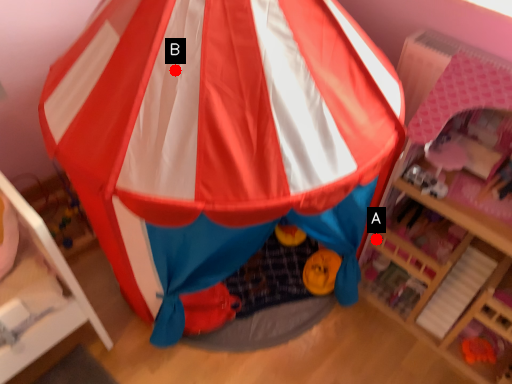
Question: Two points are circled on the image, labeled by A and B beside each circle. Which point is farther to the camera?

Choices:
 (A) A is further
 (B) B is further

Answer: (A)